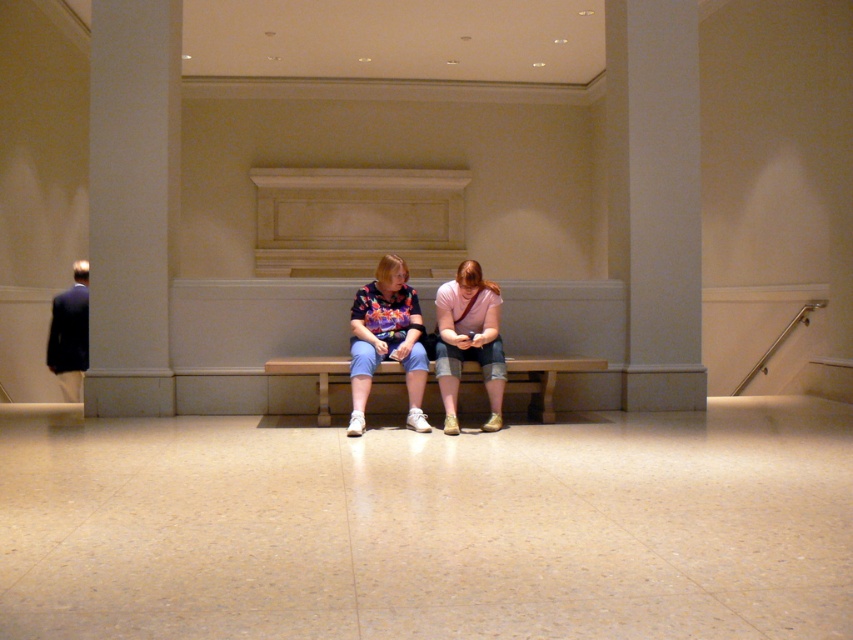
Question: Can you confirm if white marble pillar at left is thinner than white smooth pillar at center?

Choices:
 (A) yes
 (B) no

Answer: (A)

Question: Which of the following is the closest to the observer?

Choices:
 (A) white marble pillar at left
 (B) matte pink shirt at center
 (C) white smooth pillar at center

Answer: (B)

Question: Which of these objects is positioned closest to the white marble pillar at left?

Choices:
 (A) floral fabric shirt at center
 (B) white smooth pillar at center
 (C) wooden bench at center
 (D) matte pink shirt at center

Answer: (A)

Question: Does white smooth pillar at center have a larger size compared to floral fabric shirt at center?

Choices:
 (A) no
 (B) yes

Answer: (B)

Question: Which of these objects is positioned closest to the white smooth pillar at center?

Choices:
 (A) floral fabric shirt at center
 (B) white marble pillar at left
 (C) wooden bench at center

Answer: (C)

Question: Does white marble pillar at left appear on the left side of wooden bench at center?

Choices:
 (A) yes
 (B) no

Answer: (A)